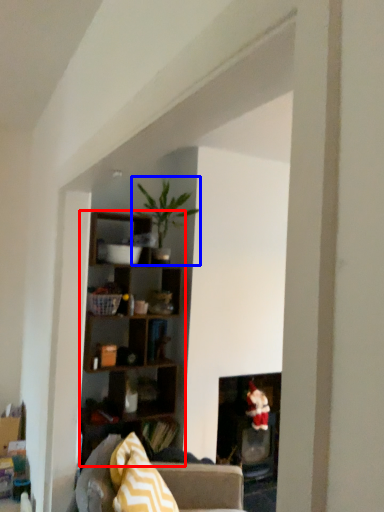
Question: Among these objects, which one is nearest to the camera, shelf (highlighted by a red box) or houseplant (highlighted by a blue box)?

Choices:
 (A) shelf
 (B) houseplant

Answer: (A)